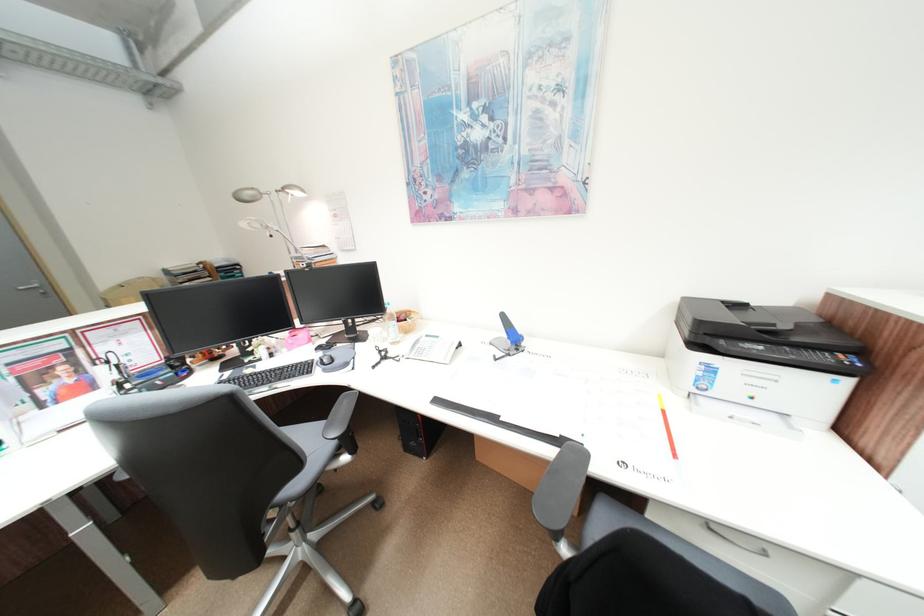
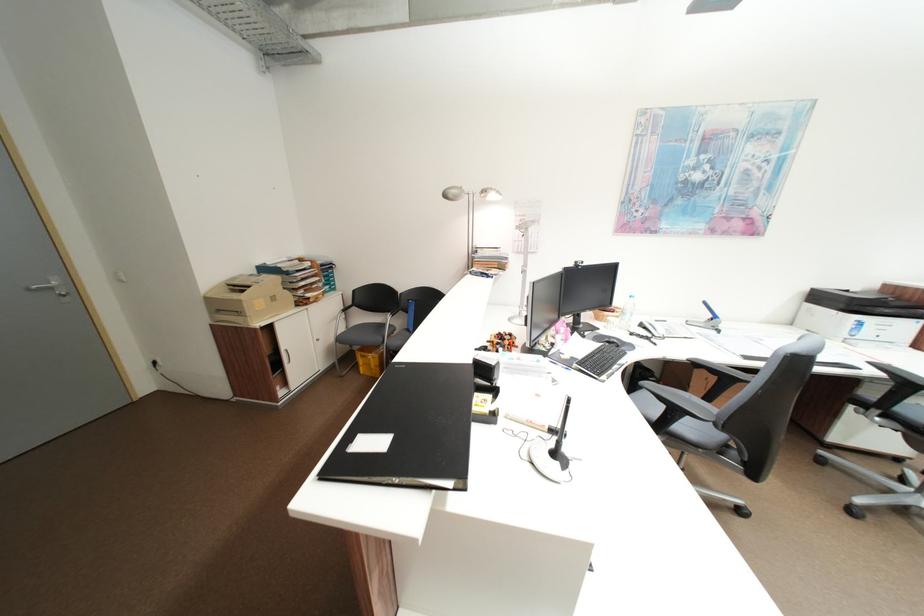
Question: In a continuous first-person perspective shot, in which direction is the camera moving?

Choices:
 (A) Left
 (B) Right
 (C) Forward
 (D) Backward

Answer: (A)